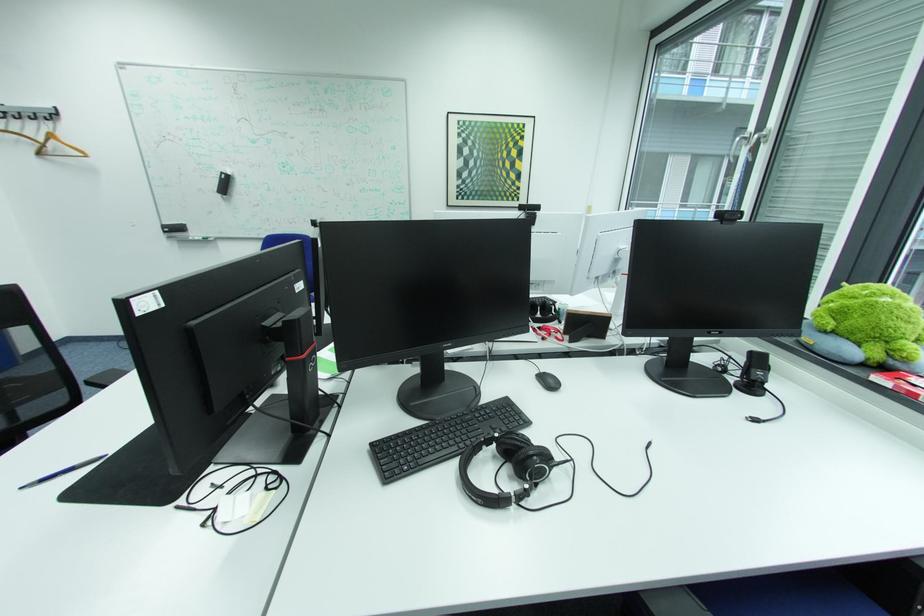
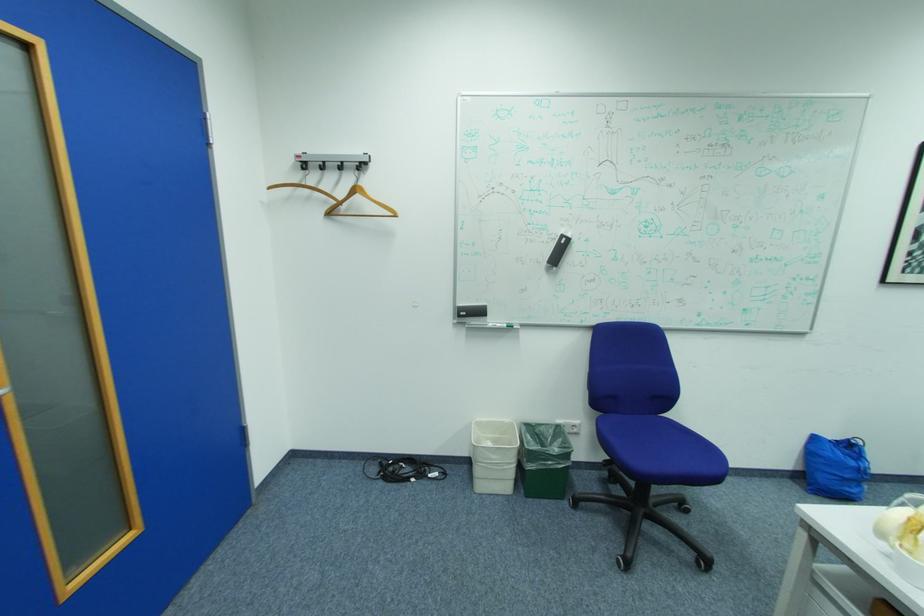
Which direction would the cameraman need to move to produce the second image?

The cameraman moved toward left, forward.